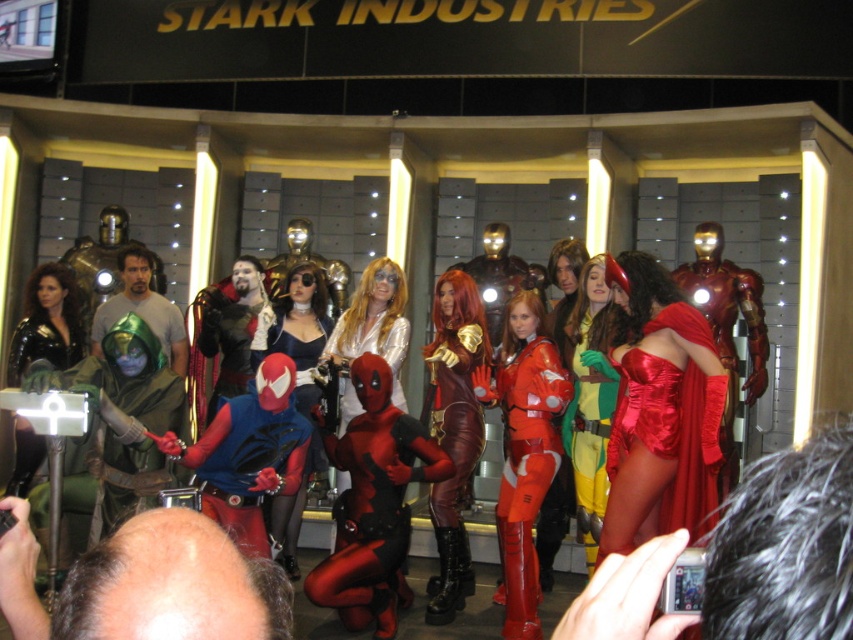
You are a photographer at the event and need to capture a photo that includes both the shiny red suit at center and the black leather jacket at left. What is the minimum distance you need to move backward to ensure both are in frame?

The minimum distance you need to move backward to include both the shiny red suit at center and the black leather jacket at left in the frame is determined by the 7.24 meters between them. However, without knowing the camera lens focal length or sensor size, an exact distance cannot be calculated. Ensure you position yourself far enough back to encompass the 7.24 meter gap between the two subjects.

You are a photographer at the event and need to capture a photo where both the shiny red suit at center and the black leather jacket at left are visible. Considering their sizes, which object should you position closer to the camera to ensure both are in frame without cropping?

The shiny red suit at center is much taller than the black leather jacket at left. To ensure both are visible without cropping, position the black leather jacket at left closer to the camera since it is shorter, allowing the taller shiny red suit at center to still fit within the frame.